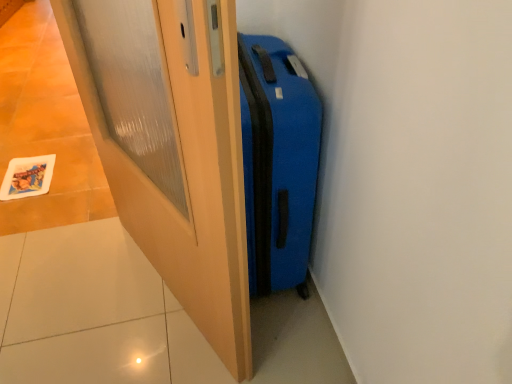
Question: From a real-world perspective, is blue matte suitcase at center positioned over matte wood door at center based on gravity?

Choices:
 (A) no
 (B) yes

Answer: (A)

Question: Does blue matte suitcase at center have a lesser height compared to matte wood door at center?

Choices:
 (A) yes
 (B) no

Answer: (A)

Question: Is the depth of blue matte suitcase at center greater than that of matte wood door at center?

Choices:
 (A) no
 (B) yes

Answer: (B)

Question: Does blue matte suitcase at center have a larger size compared to matte wood door at center?

Choices:
 (A) no
 (B) yes

Answer: (B)

Question: Does blue matte suitcase at center have a lesser width compared to matte wood door at center?

Choices:
 (A) yes
 (B) no

Answer: (B)

Question: Considering the relative sizes of blue matte suitcase at center and matte wood door at center in the image provided, is blue matte suitcase at center taller than matte wood door at center?

Choices:
 (A) yes
 (B) no

Answer: (B)

Question: Is matte wood door at center touching blue matte suitcase at center?

Choices:
 (A) yes
 (B) no

Answer: (B)

Question: Is matte wood door at center thinner than blue matte suitcase at center?

Choices:
 (A) yes
 (B) no

Answer: (A)

Question: Is matte wood door at center wider than blue matte suitcase at center?

Choices:
 (A) yes
 (B) no

Answer: (B)

Question: Is matte wood door at center to the left of blue matte suitcase at center from the viewer's perspective?

Choices:
 (A) yes
 (B) no

Answer: (A)

Question: Is matte wood door at center far away from blue matte suitcase at center?

Choices:
 (A) no
 (B) yes

Answer: (A)

Question: Can you confirm if matte wood door at center is taller than blue matte suitcase at center?

Choices:
 (A) no
 (B) yes

Answer: (B)

Question: Is blue matte suitcase at center taller or shorter than matte wood door at center?

Choices:
 (A) tall
 (B) short

Answer: (B)